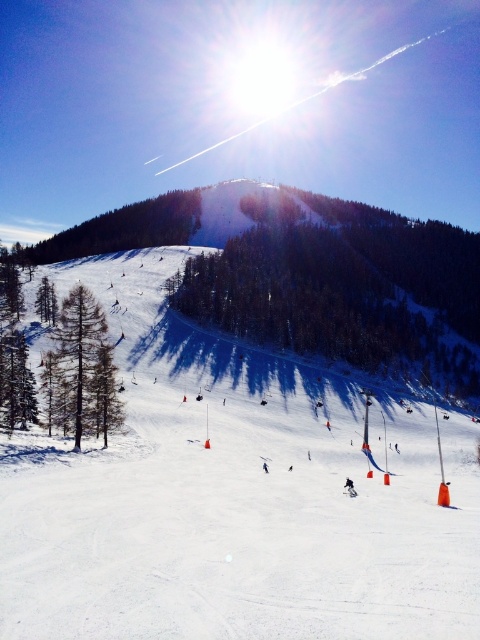
You are a photographer standing at the camera position in the winter scene. You want to take a closeup shot of the green matte tree at upper left. Can you estimate whether you can capture the tree in detail without moving your camera position?

The green matte tree at upper left is 253.47 meters from camera. Since it is quite far away, capturing it in close detail without moving the camera might be challenging unless using a telephoto lens capable of zooming in from that distance.

You are a photographer planning to capture a wide landscape shot of the white snow ski slope at center and the green textured tree at center. Based on their sizes in the image, which object would you focus on first to ensure it fits entirely within your camera frame?

The white snow ski slope at center occupies less space than the green textured tree at center, so you should focus on capturing the white snow ski slope at center first since it is smaller and requires precise framing to ensure it fits entirely within the camera frame.

You are a photographer standing at the edge of the white snow ski slope at center and want to take a photo of the green textured tree at center. Since the sun is in the upper center, will the tree be visible in your photo?

The white snow ski slope at center is in front of the green textured tree at center, so the tree may be partially or fully obscured by the slope in the photo.